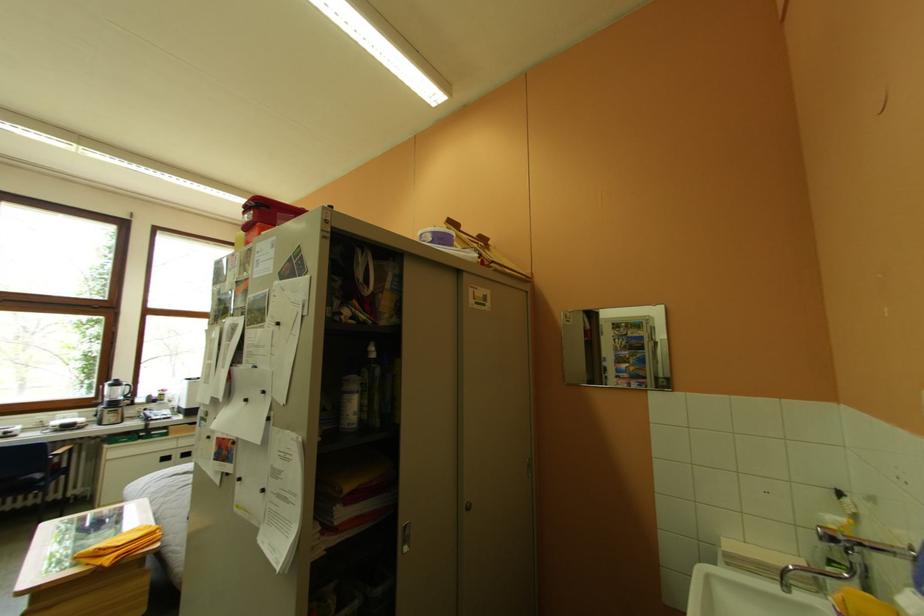
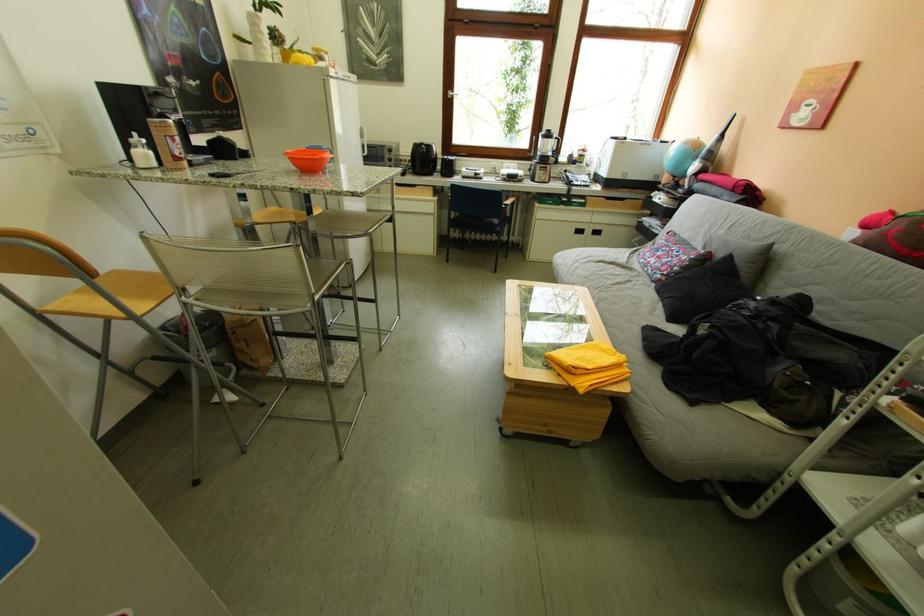
Find the pixel in the second image that matches (107,405) in the first image.

(541, 156)